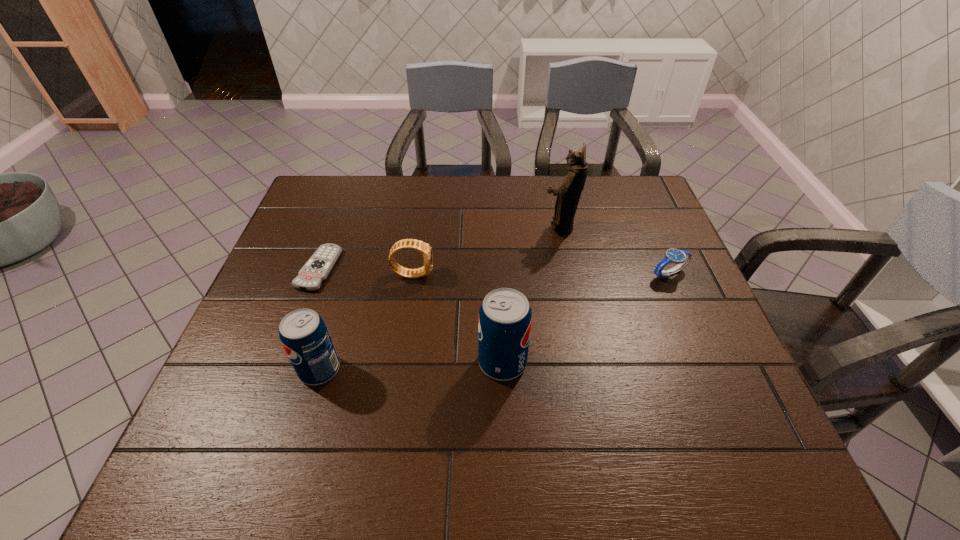
You are a GUI agent. You are given a task and a screenshot of the screen. Output one action in this format:
    pyautogui.click(x=<x>, y=<y>)
    Task: Click on the object that is at the left edge
    
    Given the screenshot: What is the action you would take?
    pyautogui.click(x=315, y=271)

This screenshot has height=540, width=960. I want to click on object that is at the right edge, so click(x=681, y=257).

At what (x,y) coordinates should I click in order to perform the action: click on vacant area at the far edge of the desktop. Please return your answer as a coordinate pair (x, y). Looking at the image, I should click on (365, 185).

This screenshot has width=960, height=540. I want to click on vacant area at the left edge of the desktop, so click(x=293, y=235).

Locate an element on the screen. Image resolution: width=960 pixels, height=540 pixels. vacant space at the right edge of the desktop is located at coordinates (718, 340).

Find the location of `blank space at the far right corner`. blank space at the far right corner is located at coordinates (604, 199).

You are a GUI agent. You are given a task and a screenshot of the screen. Output one action in this format:
    pyautogui.click(x=<x>, y=<y>)
    Task: Click on the free point at the near right corner
    Image resolution: width=960 pixels, height=540 pixels.
    Given the screenshot: What is the action you would take?
    pyautogui.click(x=703, y=384)

Identify the location of free spot between the remote control and the rightmost object. (493, 271).

You are a GUI agent. You are given a task and a screenshot of the screen. Output one action in this format:
    pyautogui.click(x=<x>, y=<y>)
    Task: Click on the free spot between the right pop and the taller watch
    
    Given the screenshot: What is the action you would take?
    click(458, 318)

The width and height of the screenshot is (960, 540). In order to click on empty space between the second shortest object and the fourth object from right to left in this screenshot , I will do `click(540, 274)`.